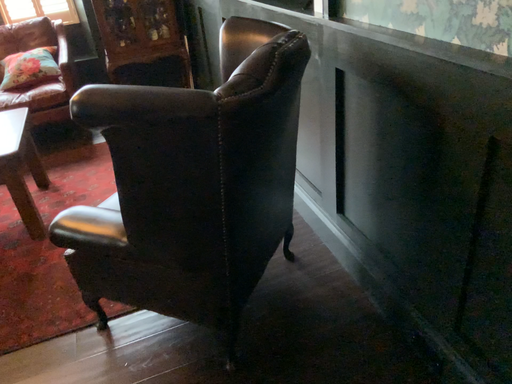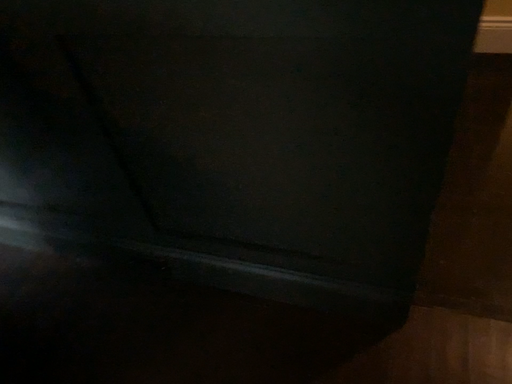
Question: How did the camera likely rotate when shooting the video?

Choices:
 (A) rotated right
 (B) rotated left

Answer: (A)